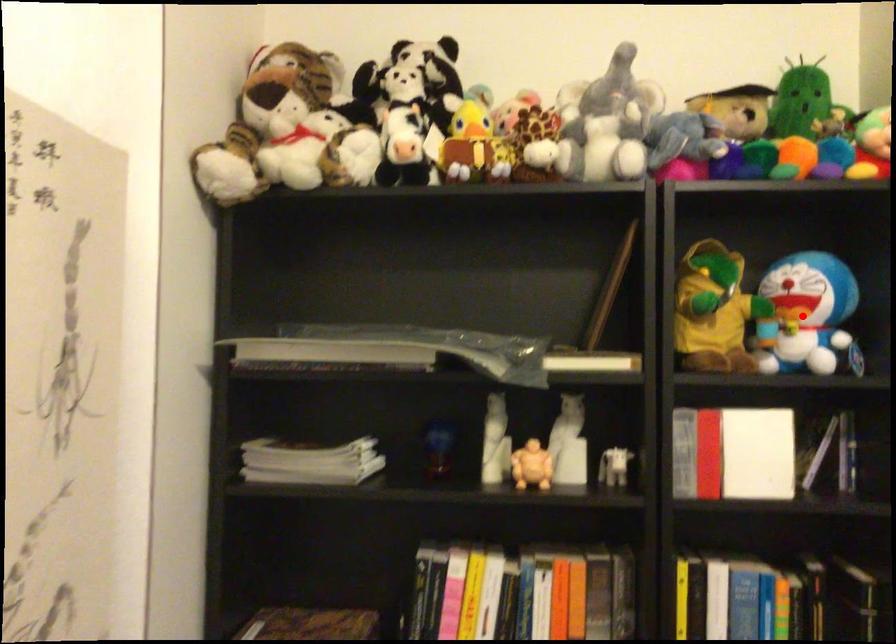
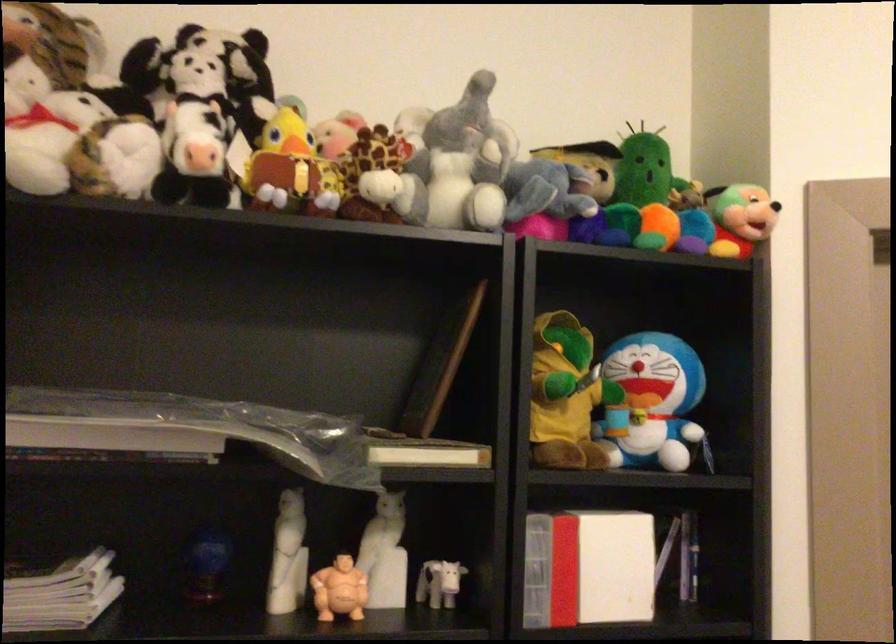
Question: A red point is marked in image1. In image2, is the corresponding 3D point closer to the camera or farther? Reply with the corresponding letter.

Choices:
 (A) The corresponding 3D point is closer.
 (B) The corresponding 3D point is farther.

Answer: (A)